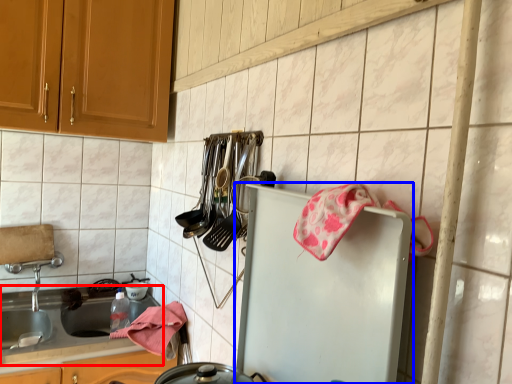
Question: Which object appears closest to the camera in this image, countertop (highlighted by a red box) or refrigerator (highlighted by a blue box)?

Choices:
 (A) countertop
 (B) refrigerator

Answer: (B)